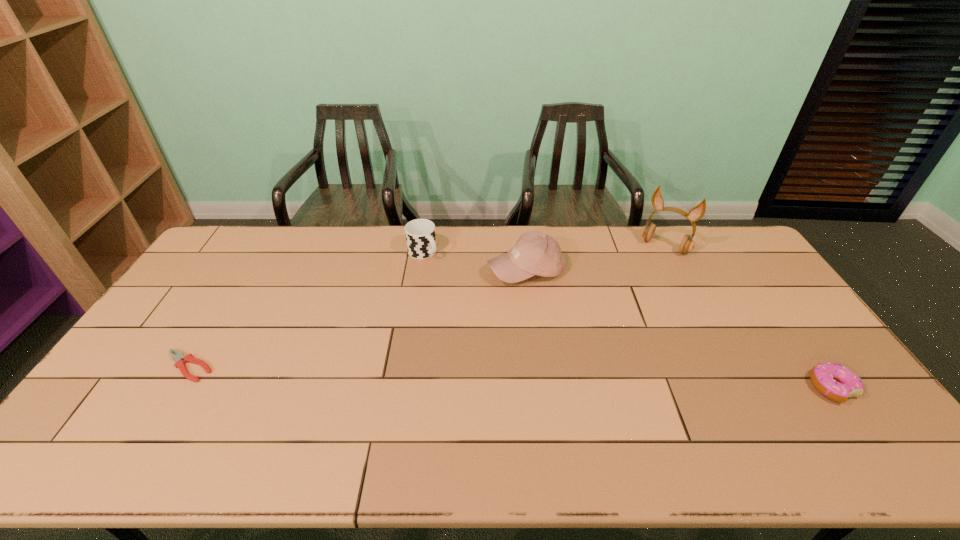
Find the location of a particular element. This screenshot has height=540, width=960. free space at the left edge of the desktop is located at coordinates (212, 277).

Identify the location of free space at the right edge of the desktop. (766, 279).

This screenshot has height=540, width=960. Identify the location of vacant area at the near left corner of the desktop. (88, 415).

Where is `vacant space that is in between the fourth object from left to right and the shortest object`? vacant space that is in between the fourth object from left to right and the shortest object is located at coordinates (426, 307).

I want to click on free space between the cup and the rightmost object, so click(628, 320).

The height and width of the screenshot is (540, 960). In order to click on vacant area that lies between the third object from left to right and the doughnut in this screenshot , I will do `click(679, 329)`.

The image size is (960, 540). I want to click on unoccupied position between the shortest object and the rightmost object, so click(x=510, y=377).

Locate an element on the screen. Image resolution: width=960 pixels, height=540 pixels. free point between the tallest object and the doughnut is located at coordinates (748, 317).

I want to click on unoccupied position between the second object from left to right and the rightmost object, so click(628, 320).

Where is `vacant region between the third tallest object and the second tallest object`? Image resolution: width=960 pixels, height=540 pixels. vacant region between the third tallest object and the second tallest object is located at coordinates (474, 261).